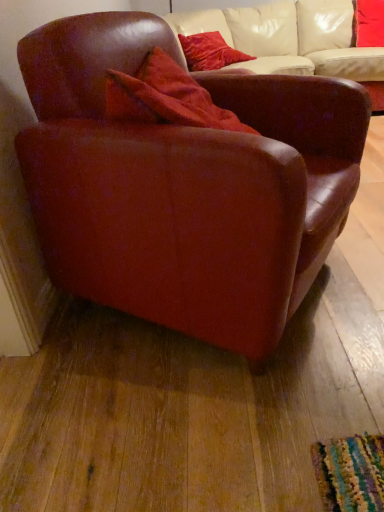
What are the coordinates of `vacant space in front of leather armchair at left` in the screenshot? It's located at (203, 421).